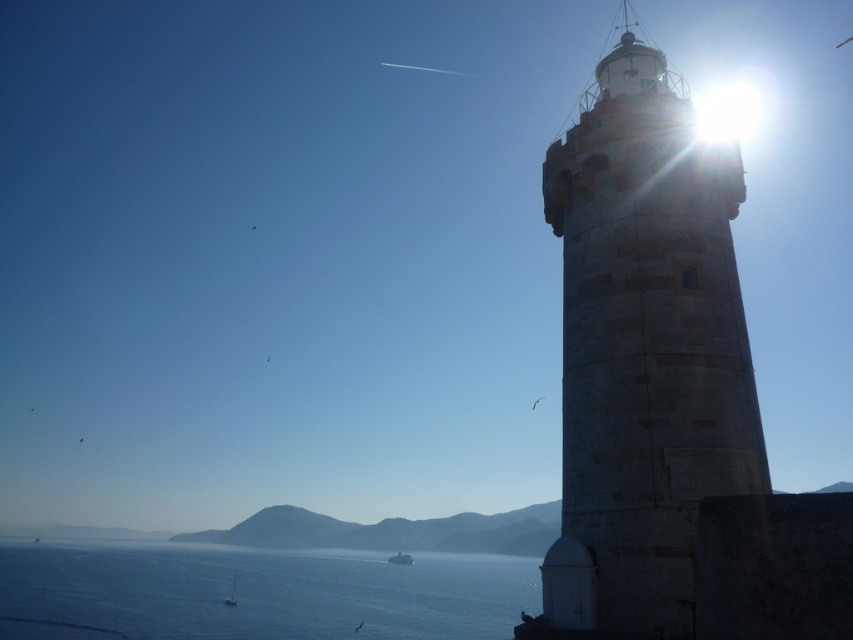
Question: Estimate the real-world distances between objects in this image. Which object is closer to the stone textured lighthouse at right?

Choices:
 (A) white plastic boat at lower center
 (B) white plastic boat at lower left
 (C) blue water at lower center

Answer: (B)

Question: Does blue water at lower center have a greater width compared to white plastic boat at lower center?

Choices:
 (A) yes
 (B) no

Answer: (A)

Question: Which of the following is the closest to the observer?

Choices:
 (A) tap(86, 586)
 (B) tap(587, 483)
 (C) tap(233, 602)

Answer: (B)

Question: Does stone textured lighthouse at right appear under white plastic boat at lower left?

Choices:
 (A) yes
 (B) no

Answer: (B)

Question: Is the position of stone textured lighthouse at right more distant than that of blue water at lower center?

Choices:
 (A) yes
 (B) no

Answer: (B)

Question: Which point is closer to the camera taking this photo?

Choices:
 (A) (393, 557)
 (B) (358, 612)
 (C) (709, 442)
 (D) (231, 586)

Answer: (C)